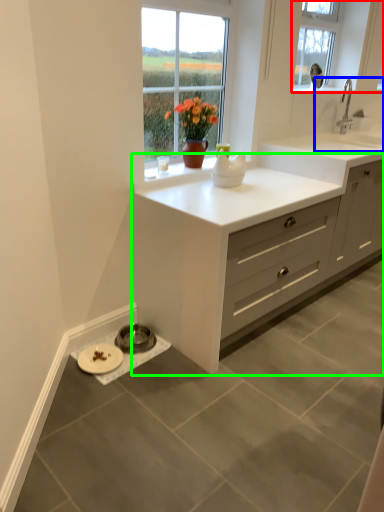
Question: Estimate the real-world distances between objects in this image. Which object is farther from window (highlighted by a red box), sink (highlighted by a blue box) or cabinetry (highlighted by a green box)?

Choices:
 (A) sink
 (B) cabinetry

Answer: (B)